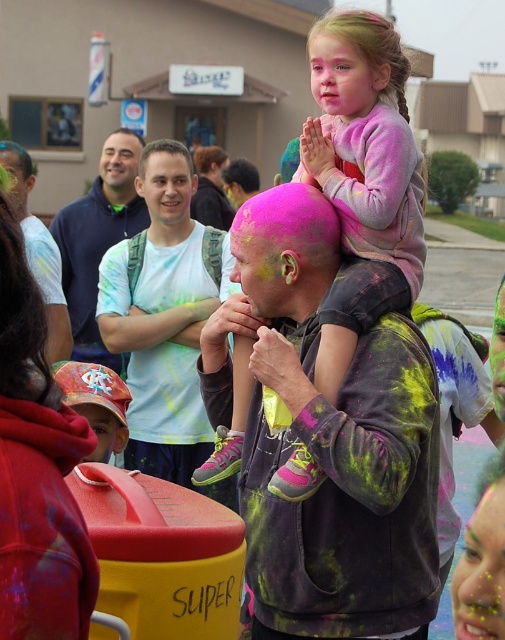
Question: Which point appears farthest from the camera in this image?

Choices:
 (A) (385, 634)
 (B) (134, 161)

Answer: (B)

Question: Which point is closer to the camera?

Choices:
 (A) (378, 304)
 (B) (62, 300)
 (C) (328, 84)
 (D) (137, 179)

Answer: (A)

Question: Is the position of matte white shirt at center more distant than that of matte white hair at center?

Choices:
 (A) yes
 (B) no

Answer: (B)

Question: Which point is farther from the camera taking this photo?

Choices:
 (A) (79, 452)
 (B) (118, 440)

Answer: (B)

Question: Is light blue tie-dye t-shirt at center to the left of matte white shirt at center from the viewer's perspective?

Choices:
 (A) yes
 (B) no

Answer: (A)

Question: Is red tie-dye hoodie at center further to the viewer compared to light blue tie-dye t-shirt at center?

Choices:
 (A) yes
 (B) no

Answer: (B)